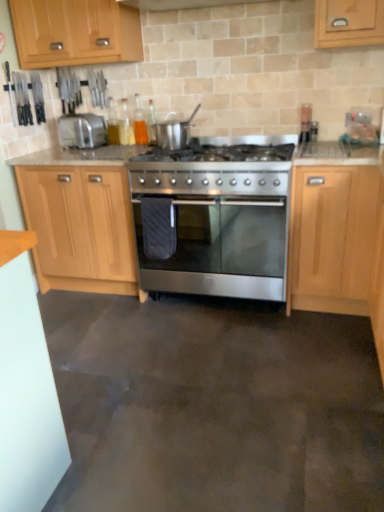
Find the location of a particular element. The image size is (384, 512). free space above light wood/texture cabinet at left, acting as the 2th cabinetry starting from the left (from a real-world perspective) is located at coordinates click(x=91, y=152).